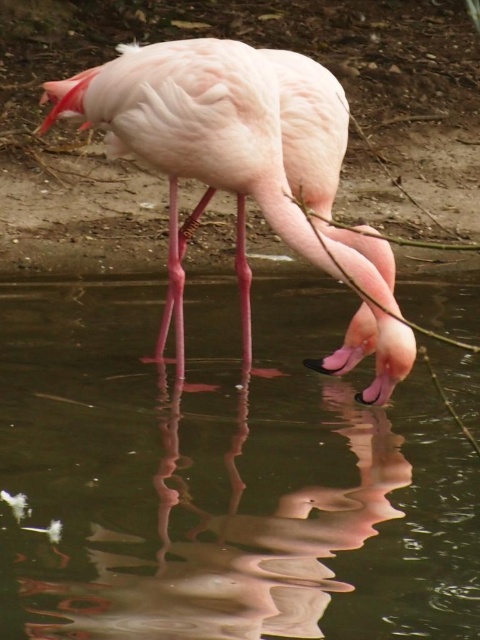
You are a photographer trying to capture the reflection of the pink feathered flamingo at center in the transparent liquid water at center. Based on the scene description, which side of the flamingo should you focus on to ensure the reflection is visible?

The transparent liquid water at center is positioned on the right side of the pink feathered flamingo at center, so focusing on the right side of the flamingo will allow you to capture its reflection in the water.

You are a photographer trying to capture the flamingo and its reflection in the water. Since the transparent liquid water at center is wider than the pink feathered flamingo at center, which object should you adjust your camera focus on to ensure both the flamingo and its reflection are in frame?

The transparent liquid water at center is wider than the pink feathered flamingo at center, so you should adjust your camera focus on the transparent liquid water at center to ensure both the flamingo and its reflection are in frame.